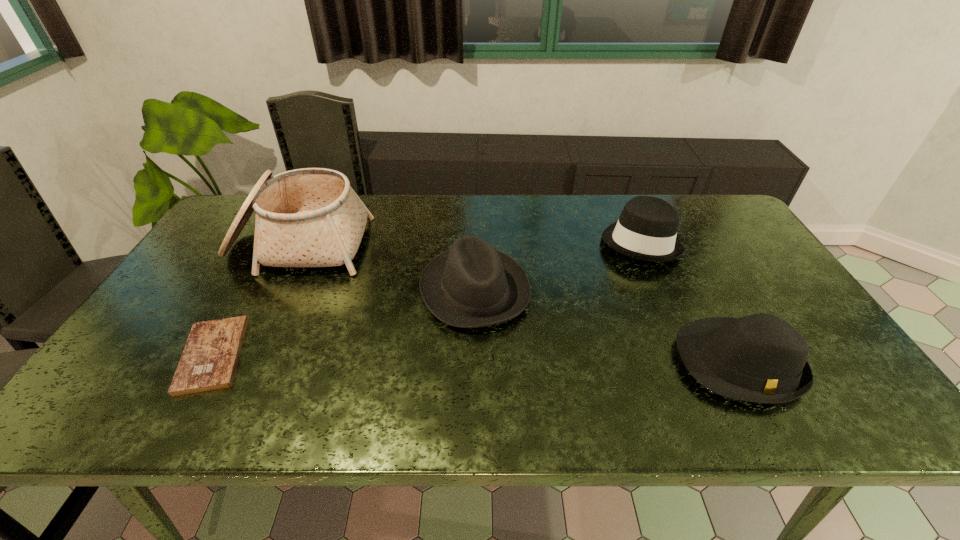
Locate an element on the screen. This screenshot has height=540, width=960. basket situated at the left edge is located at coordinates (311, 217).

Find the location of a particular element. Image resolution: width=960 pixels, height=540 pixels. Bible at the left edge is located at coordinates (209, 360).

Identify the location of object that is at the right edge. (761, 358).

You are a GUI agent. You are given a task and a screenshot of the screen. Output one action in this format:
    pyautogui.click(x=<x>, y=<y>)
    Task: Click on the object that is at the far left corner
    This screenshot has width=960, height=540.
    Given the screenshot: What is the action you would take?
    pyautogui.click(x=311, y=217)

The height and width of the screenshot is (540, 960). I want to click on object that is at the near left corner, so [x=209, y=360].

Find the location of a particular element. object at the near right corner is located at coordinates (761, 358).

You are a GUI agent. You are given a task and a screenshot of the screen. Output one action in this format:
    pyautogui.click(x=<x>, y=<y>)
    Task: Click on the vacant space at the far edge of the desktop
    The width and height of the screenshot is (960, 540).
    Given the screenshot: What is the action you would take?
    pyautogui.click(x=445, y=219)

Where is `vacant space at the near edge of the desktop`? This screenshot has width=960, height=540. vacant space at the near edge of the desktop is located at coordinates pos(358,406).

Find the location of a particular element. The width and height of the screenshot is (960, 540). free space at the left edge is located at coordinates (195, 295).

In the image, there is a desktop. At what (x,y) coordinates should I click in order to perform the action: click on vacant space at the far left corner. Please return your answer as a coordinate pair (x, y). Looking at the image, I should click on (237, 208).